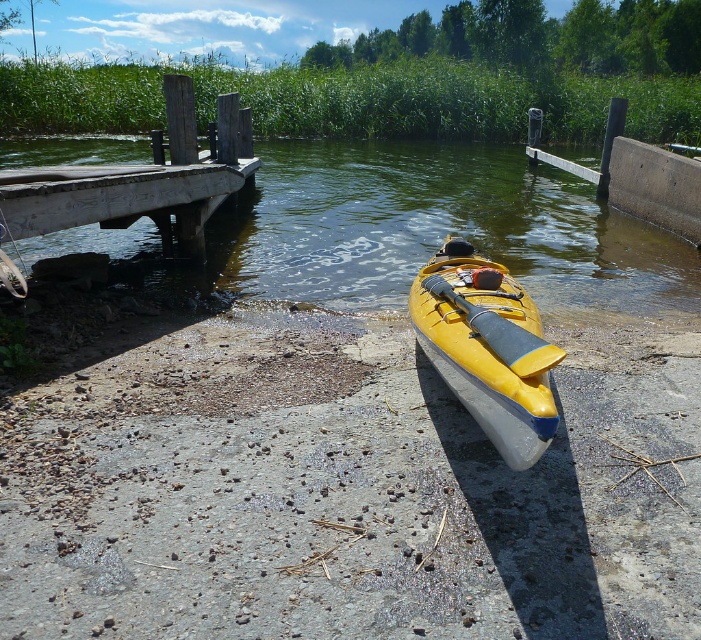
Question: Which object is farther from the camera taking this photo?

Choices:
 (A) yellow matte paddle at center
 (B) yellow matte kayak at center
 (C) wooden dock at upper left

Answer: (C)

Question: Considering the real-world distances, which object is closest to the yellow matte paddle at center?

Choices:
 (A) wooden dock at upper left
 (B) yellow plastic kayak at lower right

Answer: (A)

Question: Is wooden dock at upper left bigger than yellow matte kayak at center?

Choices:
 (A) no
 (B) yes

Answer: (B)

Question: Does yellow plastic kayak at lower right have a larger size compared to wooden dock at upper left?

Choices:
 (A) no
 (B) yes

Answer: (B)

Question: Considering the real-world distances, which object is closest to the yellow plastic kayak at lower right?

Choices:
 (A) wooden dock at upper left
 (B) yellow matte kayak at center

Answer: (A)

Question: Does yellow plastic kayak at lower right come in front of yellow matte paddle at center?

Choices:
 (A) no
 (B) yes

Answer: (A)